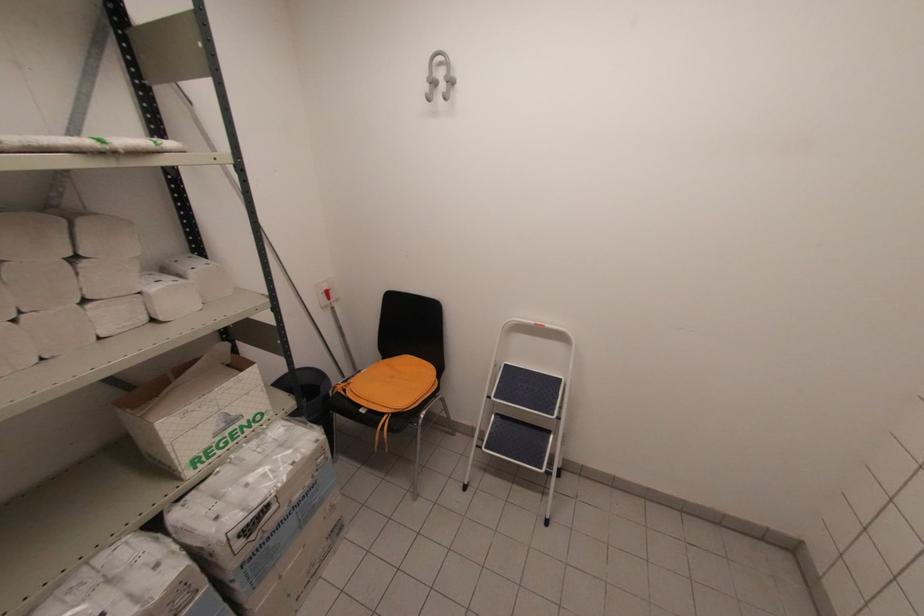
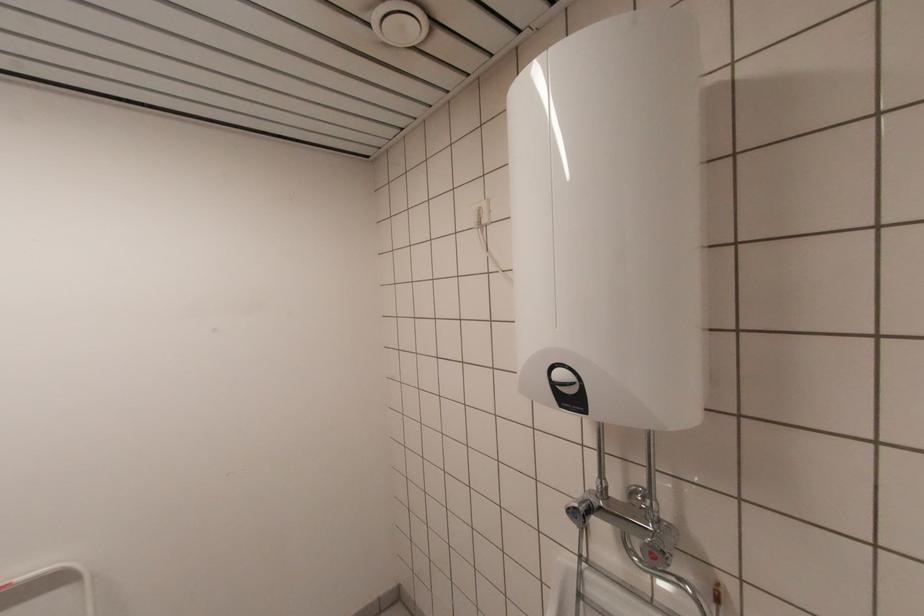
Question: The images are taken continuously from a first-person perspective. In which direction is your viewpoint rotating?

Choices:
 (A) Left
 (B) Right
 (C) Up
 (D) Down

Answer: (B)